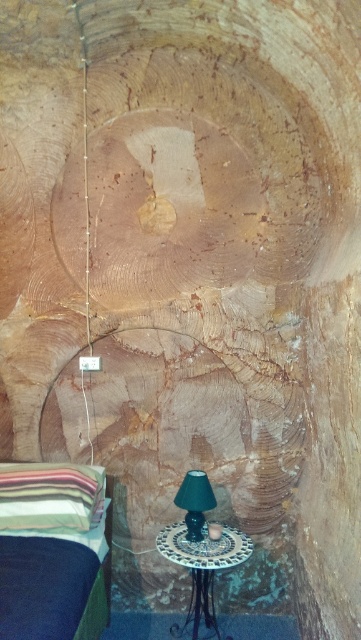
You are sitting on the bed and want to reach both the striped fabric pillow at lower left and the green fabric lampshade at lower center. Which object is closer to you?

The striped fabric pillow at lower left is closer to you because it is in front of the green fabric lampshade at lower center.

You are organizing a small event in this room and need to place a decorative item that requires a stable, flat surface. Given the striped fabric pillow at lower left and the green fabric lampshade at lower center, which object would be more suitable for placing the item?

The striped fabric pillow at lower left has a lesser height compared to the green fabric lampshade at lower center. Since the pillow is lower, it might provide a more stable and flat surface for placing the decorative item.